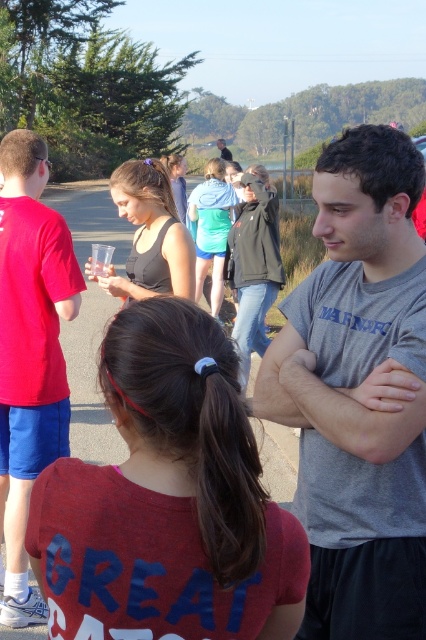
From the picture: You are at the coordinates point (29,353) and want to move towards the person in the gray shirt with MARINERS on it. Which direction should you move?

The person in the gray shirt with MARINERS on it is standing to the left side, so you should move towards the left direction from point (29,353).